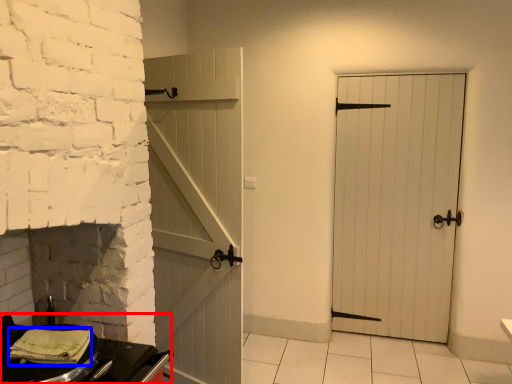
Question: Among these objects, which one is nearest to the camera, table (highlighted by a red box) or material (highlighted by a blue box)?

Choices:
 (A) table
 (B) material

Answer: (A)